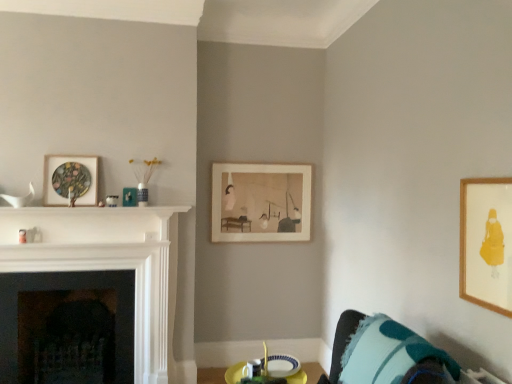
Image resolution: width=512 pixels, height=384 pixels. In order to click on blank space above white glossy fireplace at left, which is counted as the 2th fireplace, starting from the back (from a real-world perspective) in this screenshot , I will do 85,216.